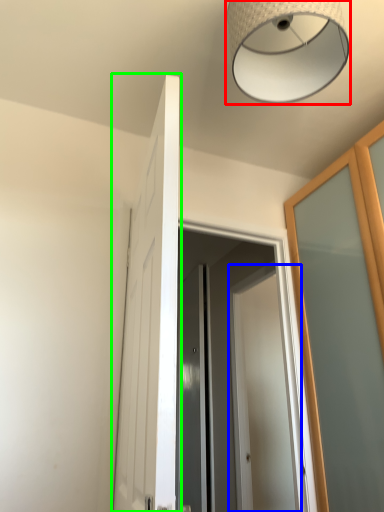
Question: Which is nearer to the lamp (highlighted by a red box)? door (highlighted by a blue box) or door (highlighted by a green box).

Choices:
 (A) door
 (B) door

Answer: (B)